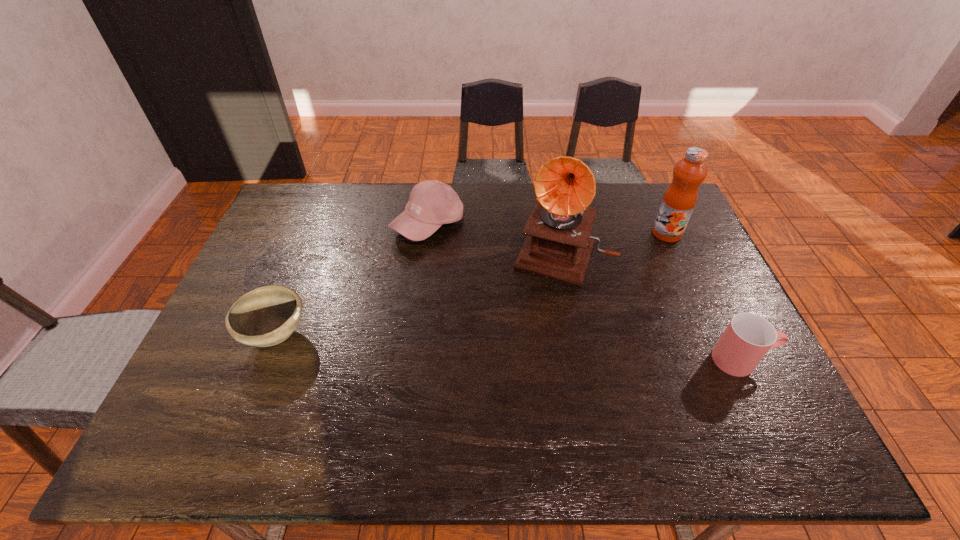
The height and width of the screenshot is (540, 960). I want to click on bowl, so click(x=266, y=316).

Locate an element on the screen. This screenshot has height=540, width=960. the leftmost object is located at coordinates (266, 316).

Where is `cup`? This screenshot has width=960, height=540. cup is located at coordinates (748, 337).

Where is `the fourth object from right to left`? the fourth object from right to left is located at coordinates (432, 203).

You are a GUI agent. You are given a task and a screenshot of the screen. Output one action in this format:
    pyautogui.click(x=<x>, y=<y>)
    Task: Click on the fruit juice
    Image resolution: width=960 pixels, height=540 pixels.
    Given the screenshot: What is the action you would take?
    pyautogui.click(x=679, y=200)

Find the location of a particular element. This screenshot has height=540, width=960. phonograph record is located at coordinates (558, 245).

This screenshot has height=540, width=960. In order to click on the tallest object in this screenshot , I will do `click(558, 245)`.

Image resolution: width=960 pixels, height=540 pixels. I want to click on free spot located 0.050m on the back of the bowl, so click(x=292, y=296).

You are a GUI agent. You are given a task and a screenshot of the screen. Output one action in this format:
    pyautogui.click(x=<x>, y=<y>)
    Task: Click on the vacant space located on the front-facing side of the fourth object from right to left
    The width and height of the screenshot is (960, 540).
    Given the screenshot: What is the action you would take?
    pyautogui.click(x=455, y=307)

You are a GUI agent. You are given a task and a screenshot of the screen. Output one action in this format:
    pyautogui.click(x=<x>, y=<y>)
    Task: Click on the vacant space positioned on the front-facing side of the fourth object from right to left
    This screenshot has width=960, height=540.
    Given the screenshot: What is the action you would take?
    pyautogui.click(x=468, y=347)